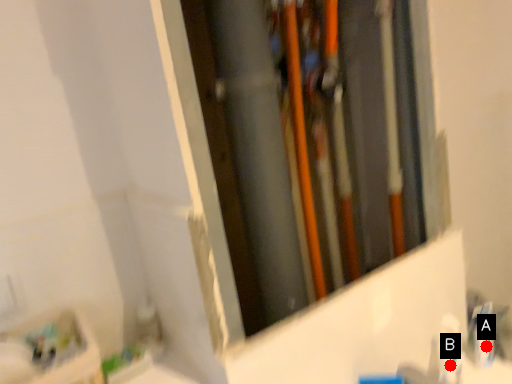
Question: Two points are circled on the image, labeled by A and B beside each circle. Among these points, which one is nearest to the camera?

Choices:
 (A) A is closer
 (B) B is closer

Answer: (B)